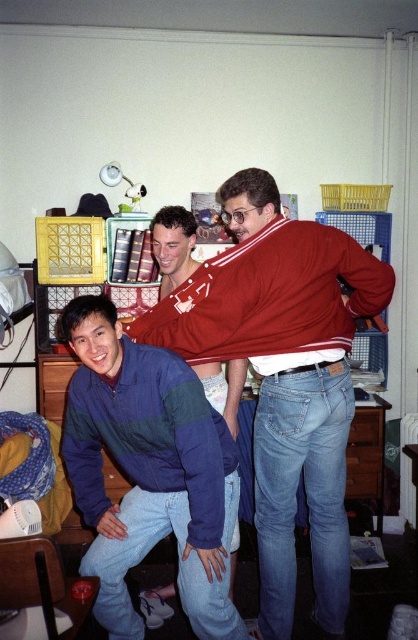
In the scene shown: You are moving a small box that is 1 meter long. You need to place it between the matte red sweater at center and the wooden drawer at lower right. Can the box fit in that space?

The matte red sweater at center is 1.01 meters from the wooden drawer at lower right, so the 1 meter long box can fit between them since the distance is slightly more than the box length.